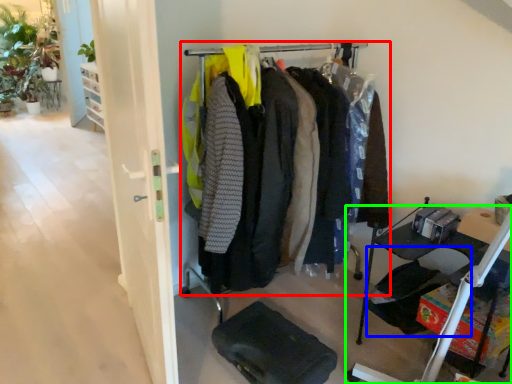
Question: Based on their relative distances, which object is nearer to closet (highlighted by a red box)? Choose from folding chair (highlighted by a blue box) and furniture (highlighted by a green box).

Choices:
 (A) folding chair
 (B) furniture

Answer: (A)